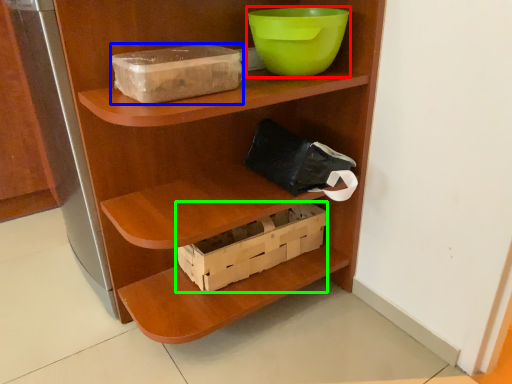
Question: Which is nearer to the bowl (highlighted by a red box)? storage box (highlighted by a blue box) or box (highlighted by a green box).

Choices:
 (A) storage box
 (B) box

Answer: (A)